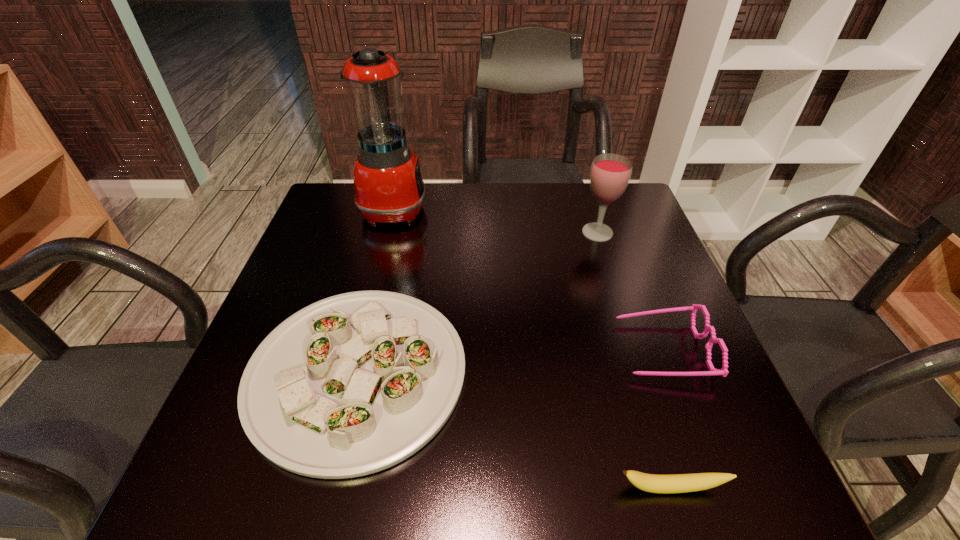
The width and height of the screenshot is (960, 540). I want to click on object present at the far left corner, so [x=388, y=184].

The height and width of the screenshot is (540, 960). Identify the location of object located in the near left corner section of the desktop. (353, 384).

Where is `object located in the far right corner section of the desktop`? The width and height of the screenshot is (960, 540). object located in the far right corner section of the desktop is located at coordinates (610, 174).

This screenshot has width=960, height=540. Find the location of `object that is at the near right corner`. object that is at the near right corner is located at coordinates (680, 483).

In the image, there is a desktop. At what (x,y) coordinates should I click in order to perform the action: click on free region at the far edge. Please return your answer as a coordinate pair (x, y). This screenshot has width=960, height=540. Looking at the image, I should click on (378, 228).

This screenshot has height=540, width=960. In the image, there is a desktop. Find the location of `vacant region at the near edge`. vacant region at the near edge is located at coordinates (543, 452).

In the image, there is a desktop. Where is `vacant space at the left edge`? vacant space at the left edge is located at coordinates (328, 249).

Identify the location of free space at the right edge. (604, 245).

This screenshot has height=540, width=960. In the image, there is a desktop. In order to click on vacant space at the far left corner in this screenshot , I will do `click(366, 232)`.

Locate an element on the screen. This screenshot has width=960, height=540. free point at the near left corner is located at coordinates (215, 495).